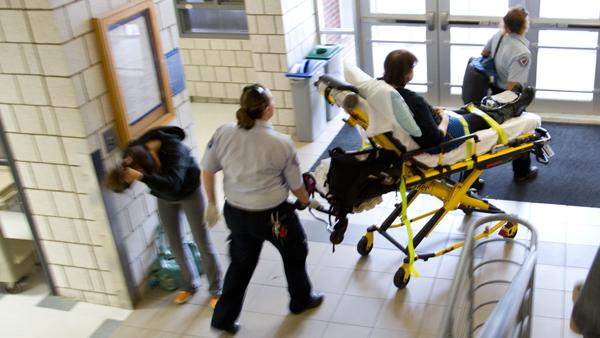
Find the location of `pillow`. pillow is located at coordinates (375, 102).